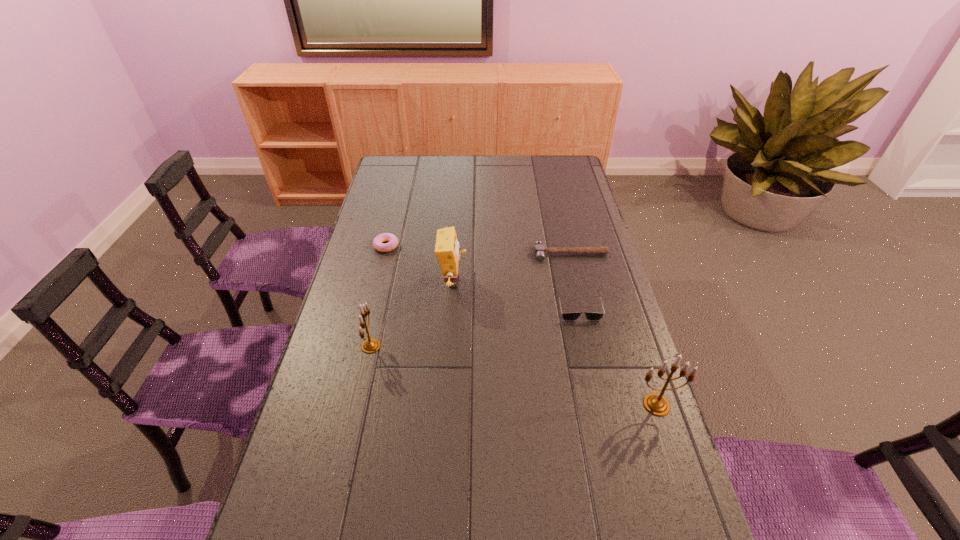
To make them evenly spaced by inserting another candle_holder among them, please locate a vacant spot for this new candle_holder. Please provide its 2D coordinates. Your answer should be formatted as a tuple, i.e. [(x, y)], where the tuple contains the x and y coordinates of a point satisfying the conditions above.

[(506, 374)]